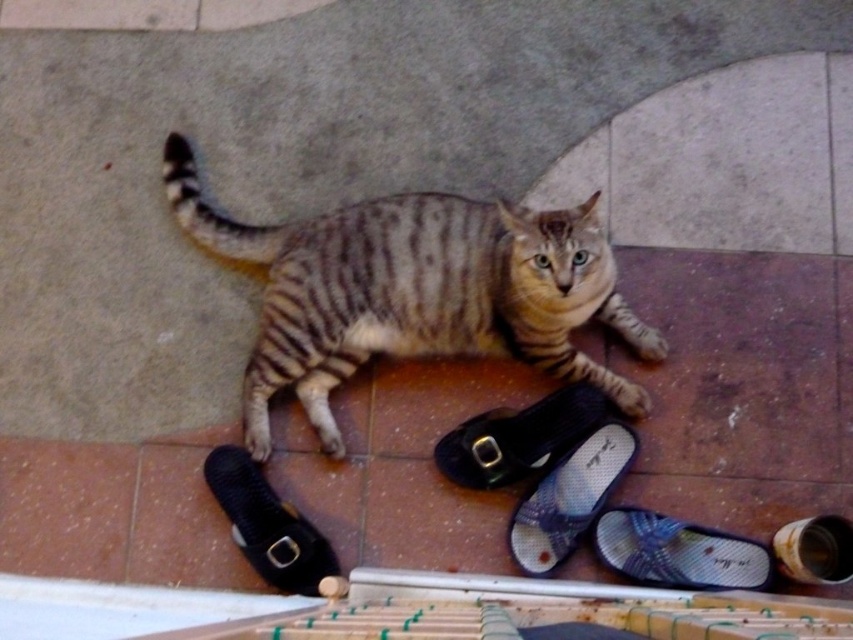
You are standing in a room with a striped cat. There are two pairs of slippers in front of the cat. One pair is black with a buckle, and the other is blue with a pattern. According to the coordinates given, which color slipper is located at the point [677,552]?

The point [677,552] indicates the blue fabric slipper at lower right.

You are a pet sitter and need to place a 30 cm long toy near the striped fur cat at center so it can reach it easily. Is the blue fabric slipper at lower center in the way of placing the toy within the cat s reach?

The distance between the striped fur cat at center and the blue fabric slipper at lower center is 34.88 centimeters. Since the toy is 30 cm long, placing it near the cat would require the space between them to be at least 30 cm. The existing distance of 34.88 cm allows enough space, so the blue fabric slipper at lower center is not in the way.